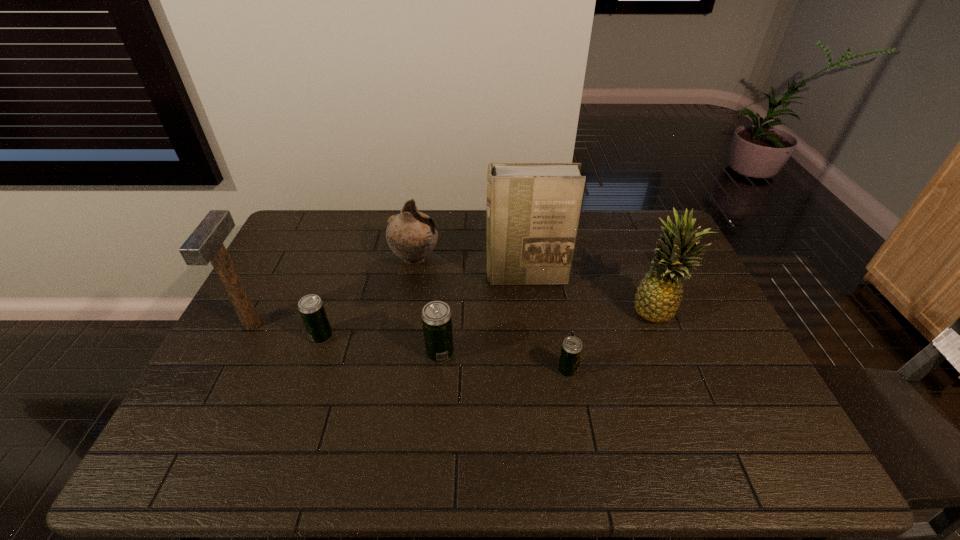
What are the coordinates of `free spot at the far edge of the desktop` in the screenshot? It's located at (582, 217).

Find the location of a particular element. This screenshot has width=960, height=540. free space at the near edge of the desktop is located at coordinates (687, 408).

Find the location of a particular element. This screenshot has height=540, width=960. free space at the left edge is located at coordinates (248, 347).

At what (x,y) coordinates should I click in order to perform the action: click on free space at the right edge of the desktop. Please return your answer as a coordinate pair (x, y). Looking at the image, I should click on (679, 343).

The height and width of the screenshot is (540, 960). I want to click on free space at the far left corner, so click(305, 233).

This screenshot has width=960, height=540. In order to click on free space at the near left corner of the desktop in this screenshot , I will do `click(247, 415)`.

The height and width of the screenshot is (540, 960). In order to click on vacant space that is in between the rightmost beer can and the rightmost object in this screenshot , I will do `click(612, 340)`.

Locate an element on the screen. vacant point located between the pineapple and the second beer can from right to left is located at coordinates (548, 332).

In order to click on empty space that is in between the fifth tallest object and the shortest object in this screenshot , I will do `click(504, 362)`.

Identify the location of vacant space that's between the pottery and the mallet. (333, 292).